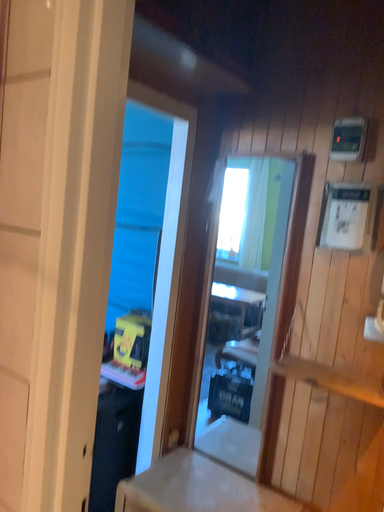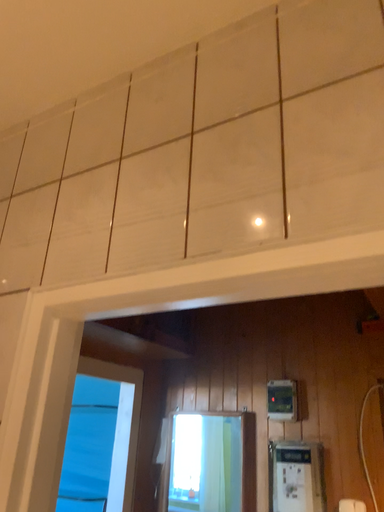
Question: How did the camera likely rotate when shooting the video?

Choices:
 (A) rotated upward
 (B) rotated downward

Answer: (A)